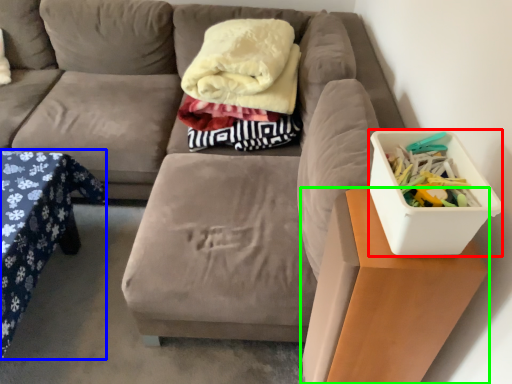
Question: Based on their relative distances, which object is nearer to storage box (highlighted by a red box)? Choose from table (highlighted by a blue box) and table (highlighted by a green box).

Choices:
 (A) table
 (B) table

Answer: (B)